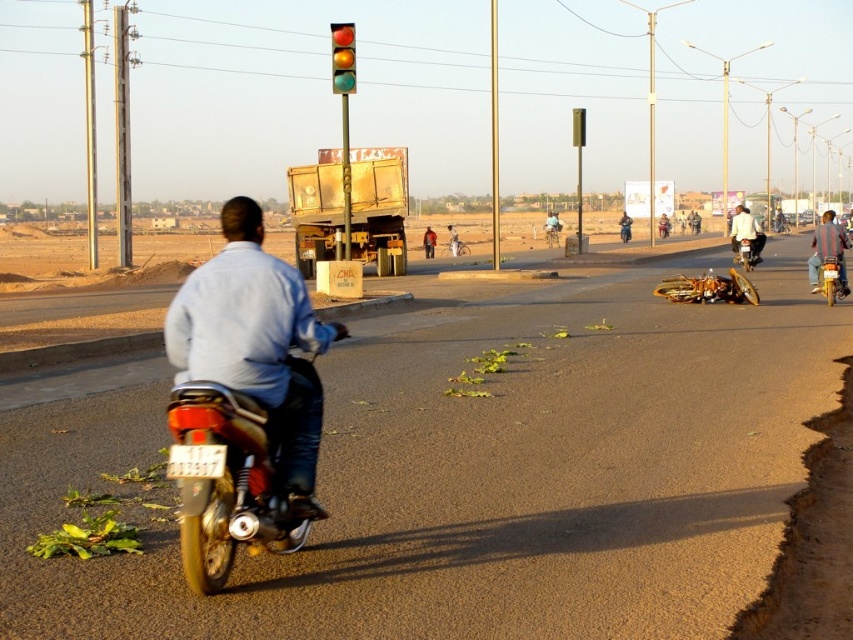
Question: Among these points, which one is farthest from the camera?

Choices:
 (A) (552, 237)
 (B) (190, 376)
 (C) (253, 413)

Answer: (A)

Question: Can you confirm if metallic gold motorcycle at center-left is wider than glassy red traffic light at upper center?

Choices:
 (A) no
 (B) yes

Answer: (A)

Question: Estimate the real-world distances between objects in this image. Which object is closer to the reflective silver jacket at right?

Choices:
 (A) silver metallic bicycle at center
 (B) metallic silver bicycle at center
 (C) light blue shirt at center
 (D) glassy red traffic light at upper center

Answer: (D)

Question: Among these objects, which one is nearest to the camera?

Choices:
 (A) metallic rectangular traffic light at center
 (B) metallic silver bicycle at center
 (C) brushed metal motorcycle at center

Answer: (A)

Question: Is reflective silver jacket at right in front of metallic gold motorcycle at right?

Choices:
 (A) no
 (B) yes

Answer: (A)

Question: Does metallic gold motorcycle at right have a lesser width compared to metallic silver bicycle at center?

Choices:
 (A) yes
 (B) no

Answer: (A)